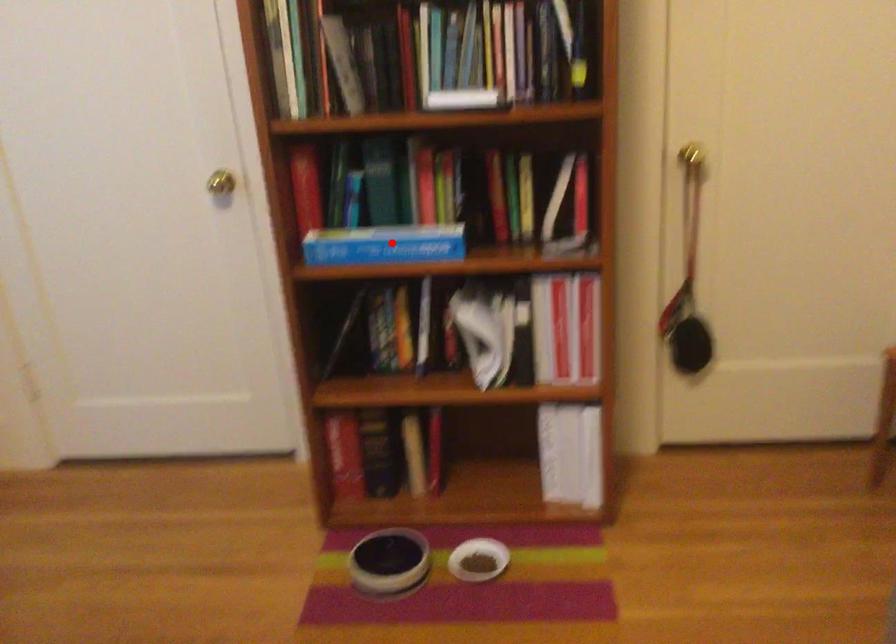
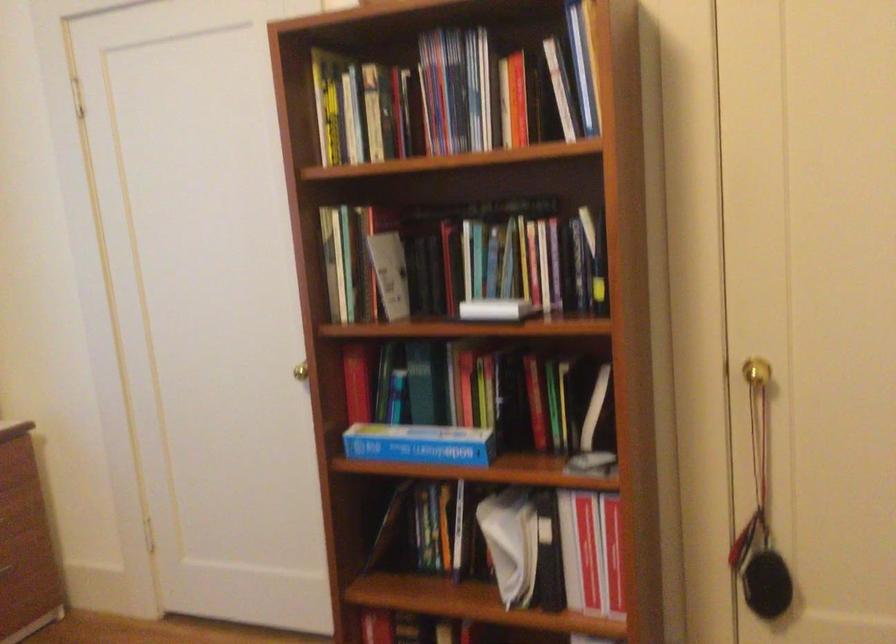
Find the pixel in the second image that matches the highlighted location in the first image.

(419, 444)